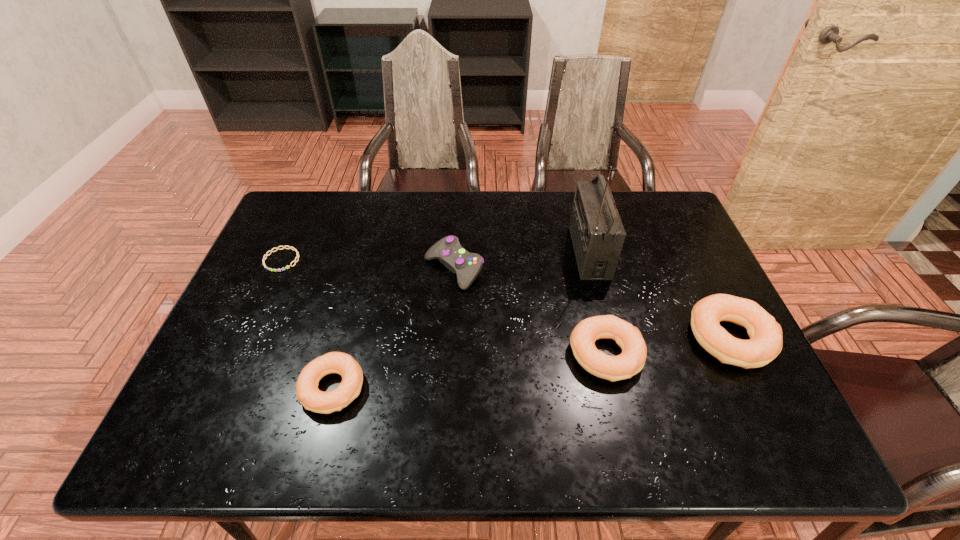
Locate an element on the screen. Image resolution: width=960 pixels, height=540 pixels. free region that satisfies the following two spatial constraints: 1. on the surface of the bracelet showing star-shaped elements; 2. on the right side of the second bagel from right to left is located at coordinates (239, 354).

The width and height of the screenshot is (960, 540). I want to click on vacant area in the image that satisfies the following two spatial constraints: 1. on the surface of the bracelet showing star-shaped elements; 2. on the right side of the second shortest object, so click(225, 388).

This screenshot has width=960, height=540. In order to click on free spot that satisfies the following two spatial constraints: 1. on the surface of the bracelet showing star-shaped elements; 2. on the right side of the second shortest bagel in this screenshot , I will do `click(239, 354)`.

Find the location of a particular element. This screenshot has width=960, height=540. vacant point that satisfies the following two spatial constraints: 1. on the surface of the second object from left to right showing star-shaped elements; 2. on the left side of the shortest object is located at coordinates (225, 388).